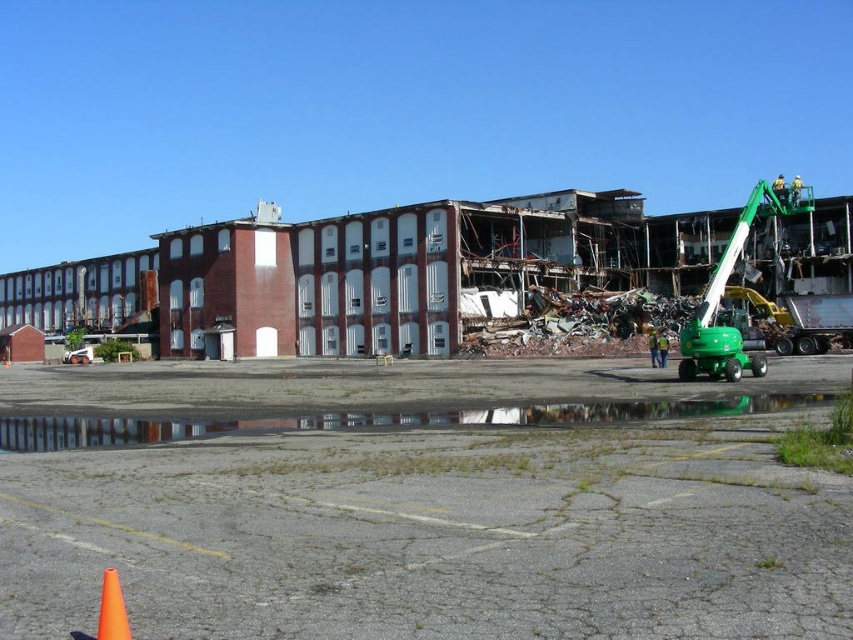
You are a safety inspector evaluating the demolition site. You notice the rusty metal debris at center and the orange plastic traffic cone at lower left. Which object is bigger in size?

The rusty metal debris at center has a larger size compared to the orange plastic traffic cone at lower left, so the rusty metal debris at center is bigger.

You are a safety inspector needing to walk from the green rubber excavator at right to the reflective concrete puddle at lower center. How far will you have to walk?

You will have to walk 18.87 meters from the green rubber excavator at right to the reflective concrete puddle at lower center.

You are a construction worker who needs to cross from the cracked asphalt parking lot to the green rubber excavator at right. There is a reflective concrete puddle at lower center in your path. Can you step over it without getting your boots wet? Explain why or why not based on the puddle and excavator sizes.

The reflective concrete puddle at lower center is thinner than the green rubber excavator at right. Since the puddle is thinner, it likely has a smaller width, making it possible to step over without getting your boots wet.